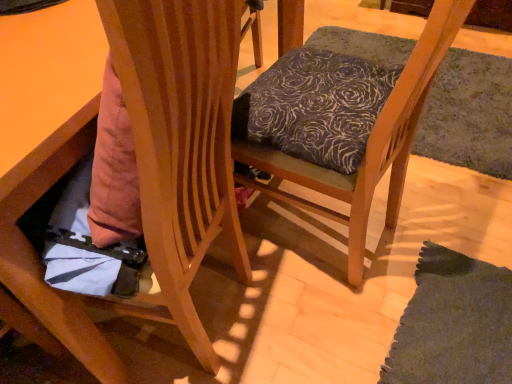
This screenshot has height=384, width=512. In order to click on unoccupied region to the right of textured fabric cushion at center, the first chair when ordered from right to left in this screenshot , I will do `click(446, 209)`.